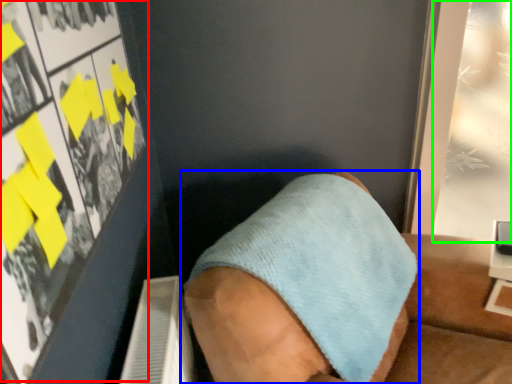
Question: Based on their relative distances, which object is nearer to poster page (highlighted by a red box)? Choose from footwear (highlighted by a blue box) and poster page (highlighted by a green box).

Choices:
 (A) footwear
 (B) poster page

Answer: (A)